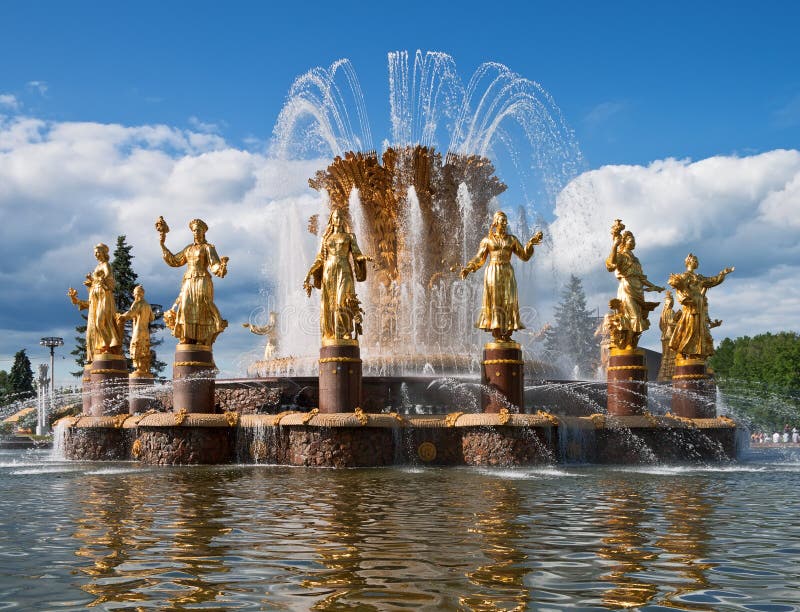
Identify the location of gold statue of women. (346, 244), (488, 259), (633, 273), (689, 285), (668, 311), (268, 326), (190, 239), (140, 306), (102, 261), (78, 305).